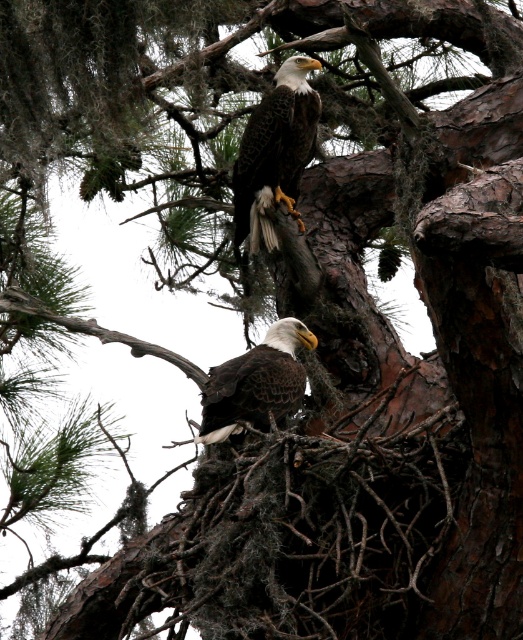
Question: Which object appears farthest from the camera in this image?

Choices:
 (A) dark brown feathers at center
 (B) dark brown feathers at upper center

Answer: (B)

Question: Which of the following is the farthest from the observer?

Choices:
 (A) (225, 372)
 (B) (283, 157)

Answer: (B)

Question: Among these objects, which one is nearest to the camera?

Choices:
 (A) dark brown feathers at center
 (B) dark brown feathers at upper center

Answer: (A)

Question: Is dark brown feathers at upper center above dark brown feathers at center?

Choices:
 (A) no
 (B) yes

Answer: (B)

Question: Is dark brown feathers at upper center positioned before dark brown feathers at center?

Choices:
 (A) no
 (B) yes

Answer: (A)

Question: From the image, what is the correct spatial relationship of dark brown feathers at upper center in relation to dark brown feathers at center?

Choices:
 (A) right
 (B) left

Answer: (A)